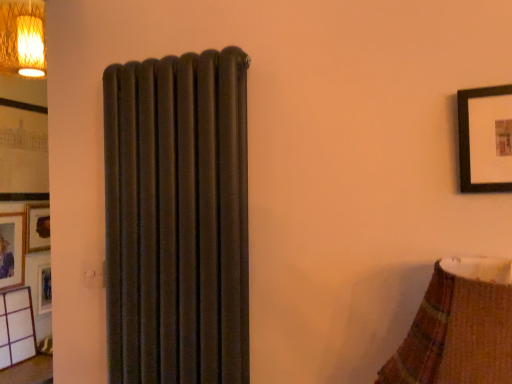
Question: Should I look upward or downward to see matte wooden picture frame at left, marked as the second picture frame in a top-to-bottom arrangement?

Choices:
 (A) up
 (B) down

Answer: (B)

Question: Would you consider matte wooden picture frame at left, marked as the second picture frame in a top-to-bottom arrangement, to be distant from matte black picture frame at left, arranged as the 2th picture frame when ordered from the bottom?

Choices:
 (A) yes
 (B) no

Answer: (B)

Question: Is matte wooden picture frame at left, marked as the second picture frame in a top-to-bottom arrangement, facing towards matte black picture frame at left, the first picture frame positioned from the top?

Choices:
 (A) yes
 (B) no

Answer: (B)

Question: From a real-world perspective, is matte wooden picture frame at left, the 1th picture frame positioned from the bottom, on matte black picture frame at left, arranged as the 2th picture frame when ordered from the bottom?

Choices:
 (A) yes
 (B) no

Answer: (B)

Question: Is matte wooden picture frame at left, marked as the second picture frame in a top-to-bottom arrangement, further to camera compared to matte black picture frame at left, the first picture frame positioned from the top?

Choices:
 (A) no
 (B) yes

Answer: (A)

Question: From the image's perspective, does matte wooden picture frame at left, the 1th picture frame positioned from the bottom, appear higher than matte black picture frame at left, arranged as the 2th picture frame when ordered from the bottom?

Choices:
 (A) yes
 (B) no

Answer: (B)

Question: Is matte wooden picture frame at left, marked as the second picture frame in a top-to-bottom arrangement, touching matte black picture frame at left, the first picture frame positioned from the top?

Choices:
 (A) no
 (B) yes

Answer: (A)

Question: Can you confirm if matte black picture frame at left, the first picture frame positioned from the top, is positioned to the left of matte wooden picture frame at left, marked as the second picture frame in a top-to-bottom arrangement?

Choices:
 (A) yes
 (B) no

Answer: (B)

Question: Is matte black picture frame at left, the first picture frame positioned from the top, far from matte wooden picture frame at left, the 1th picture frame positioned from the bottom?

Choices:
 (A) no
 (B) yes

Answer: (A)

Question: Can you confirm if matte black picture frame at left, the first picture frame positioned from the top, is wider than matte wooden picture frame at left, the 1th picture frame positioned from the bottom?

Choices:
 (A) no
 (B) yes

Answer: (B)

Question: From a real-world perspective, is matte black picture frame at left, the first picture frame positioned from the top, physically below matte wooden picture frame at left, marked as the second picture frame in a top-to-bottom arrangement?

Choices:
 (A) yes
 (B) no

Answer: (B)

Question: Considering the relative positions of matte black picture frame at left, the first picture frame positioned from the top, and matte wooden picture frame at left, marked as the second picture frame in a top-to-bottom arrangement, in the image provided, is matte black picture frame at left, the first picture frame positioned from the top, to the right of matte wooden picture frame at left, marked as the second picture frame in a top-to-bottom arrangement, from the viewer's perspective?

Choices:
 (A) no
 (B) yes

Answer: (B)

Question: Is matte black picture frame at left, the first picture frame positioned from the top, taller than matte wooden picture frame at left, marked as the second picture frame in a top-to-bottom arrangement?

Choices:
 (A) no
 (B) yes

Answer: (B)

Question: Is matte black picture frame at left, arranged as the 2th picture frame when ordered from the bottom, to the left or to the right of matte wooden picture frame at left, the 1th picture frame positioned from the bottom, in the image?

Choices:
 (A) right
 (B) left

Answer: (A)